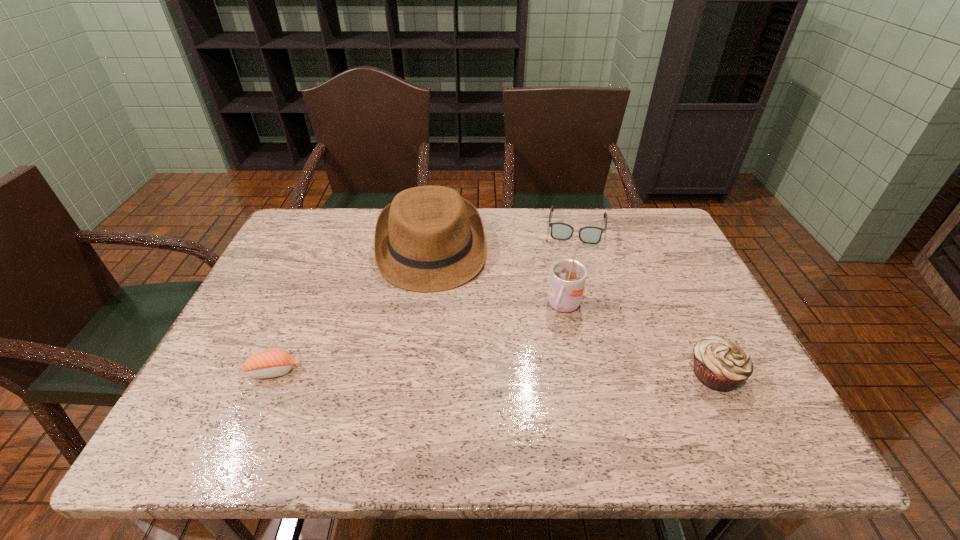
Select which object appears as the second closest to the spectacles. Please provide its 2D coordinates. Your answer should be formatted as a tuple, i.e. [(x, y)], where the tuple contains the x and y coordinates of a point satisfying the conditions above.

[(567, 279)]

Where is `free space that satisfies the following two spatial constraints: 1. on the back side of the spectacles; 2. on the left side of the cup`? free space that satisfies the following two spatial constraints: 1. on the back side of the spectacles; 2. on the left side of the cup is located at coordinates (548, 227).